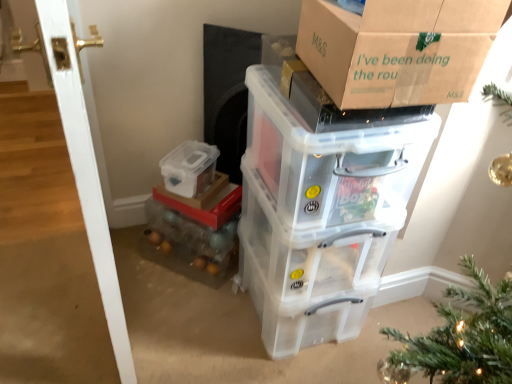
Where is `free space below white glossy door at left (from a real-world perspective)`? free space below white glossy door at left (from a real-world perspective) is located at coordinates (75, 309).